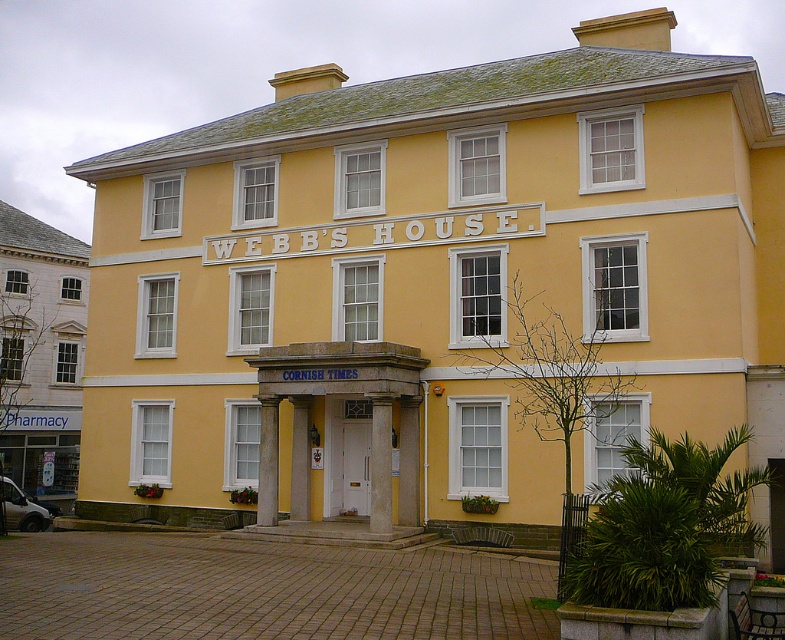
Between white matte building at left and yellow matte/texture columns at center, which one is positioned higher?

white matte building at left

Can you confirm if white matte building at left is smaller than yellow matte/texture columns at center?

No, white matte building at left is not smaller than yellow matte/texture columns at center.

Does point (8, 403) lie behind point (417, 369)?

That is True.

At what (x,y) coordinates should I click in order to perform the action: click on white matte building at left. Please return your answer as a coordinate pair (x, y). Image resolution: width=785 pixels, height=640 pixels. Looking at the image, I should click on click(x=39, y=353).